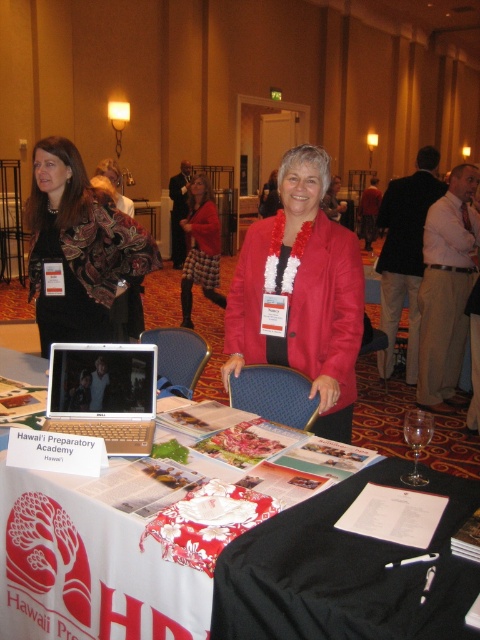
Question: Does matte black scarf at upper left appear under clear glass wine glass at center?

Choices:
 (A) no
 (B) yes

Answer: (A)

Question: Among these objects, which one is farthest from the camera?

Choices:
 (A) white paper at center
 (B) silver metallic laptop at center
 (C) matte red jacket at center

Answer: (C)

Question: Estimate the real-world distances between objects in this image. Which object is farther from the white paper at center?

Choices:
 (A) red plaid skirt at center
 (B) matte red jacket at center
 (C) silver metallic laptop at center

Answer: (A)

Question: Is matte red jacket at center positioned in front of silver metallic laptop at center?

Choices:
 (A) yes
 (B) no

Answer: (B)

Question: Which object is positioned farthest from the clear glass wine glass at center?

Choices:
 (A) red plaid skirt at center
 (B) silver metallic laptop at center
 (C) white paper at center
 (D) matte red jacket at center

Answer: (A)

Question: Is white paper at center closer to camera compared to matte black scarf at upper left?

Choices:
 (A) yes
 (B) no

Answer: (A)